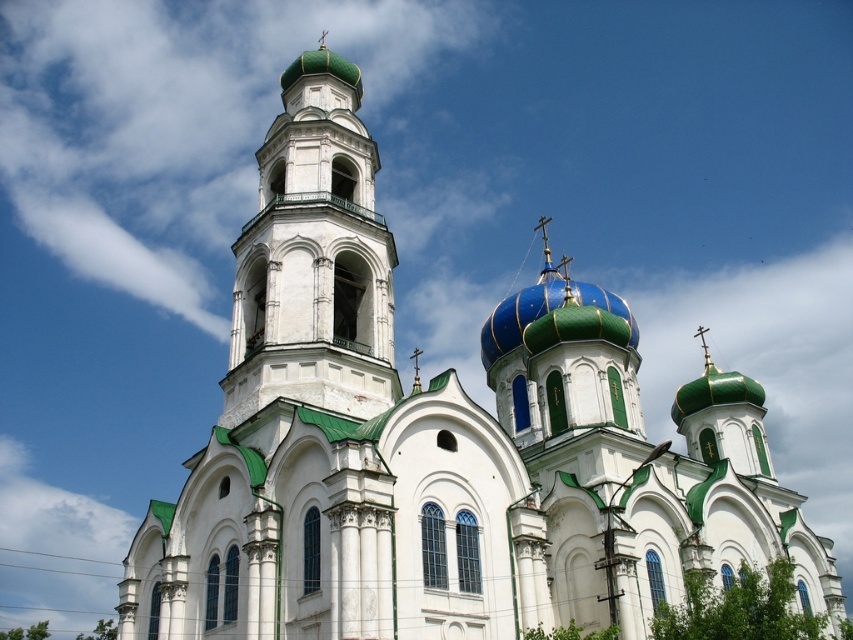
Looking at this image, you are standing in front of the church and notice a specific point marked at coordinates point (312, 259). According to the image, where exactly is this point located?

The point (312, 259) is located on the white stone bell tower at center.

Based on the scene described, which object is positioned to the left when observing the white stone bell tower at center and the blue metallic dome at center?

The white stone bell tower at center is positioned to the left of the blue metallic dome at center.